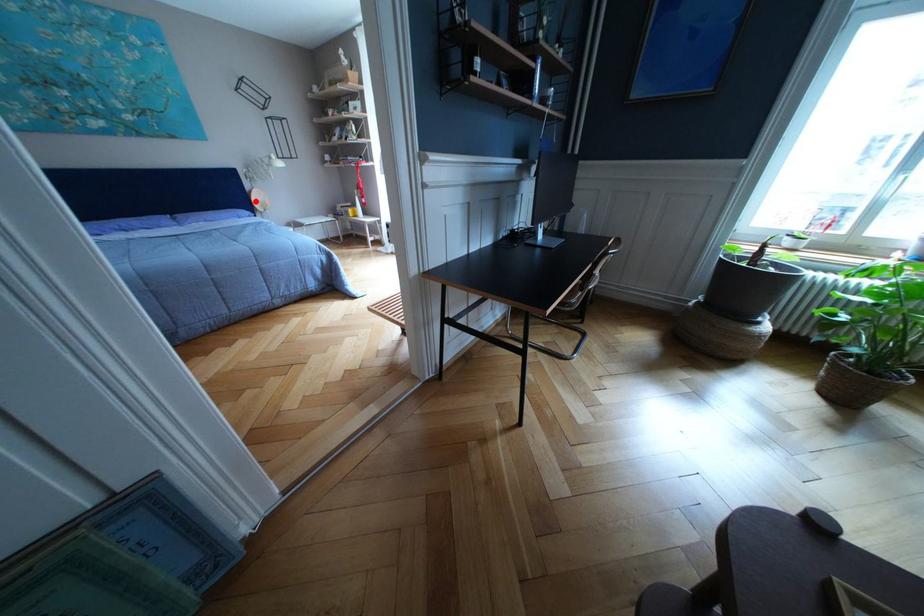
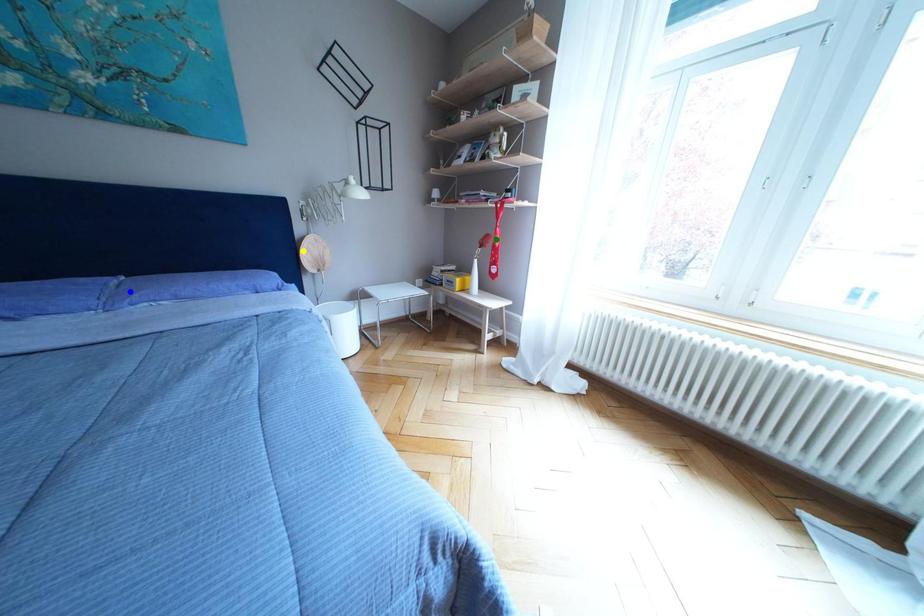
Question: I am providing you with two images of the same scene from different viewpoints. A red point is marked on the first image. You are given multiple points on the second image. In image 2, which mark is for the same physical point as the one in image 1?

Choices:
 (A) green point
 (B) yellow point
 (C) blue point

Answer: (B)